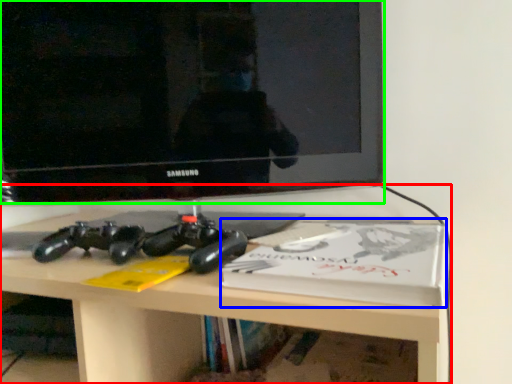
Question: Which is farther away from desk (highlighted by a red box)? paperback book (highlighted by a blue box) or television (highlighted by a green box)?

Choices:
 (A) paperback book
 (B) television

Answer: (B)